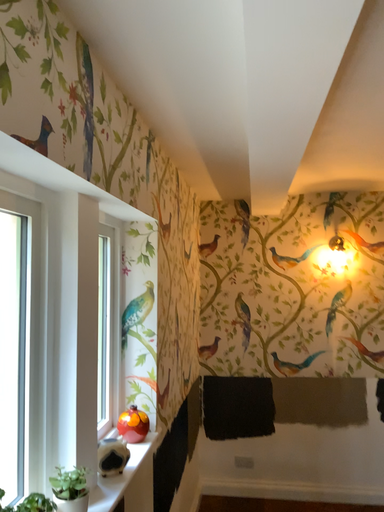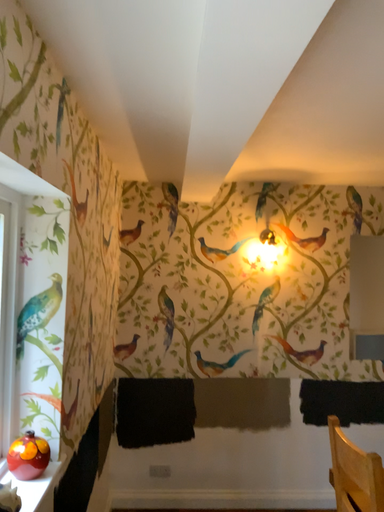
Question: Which way did the camera rotate in the video?

Choices:
 (A) rotated left
 (B) rotated right

Answer: (B)